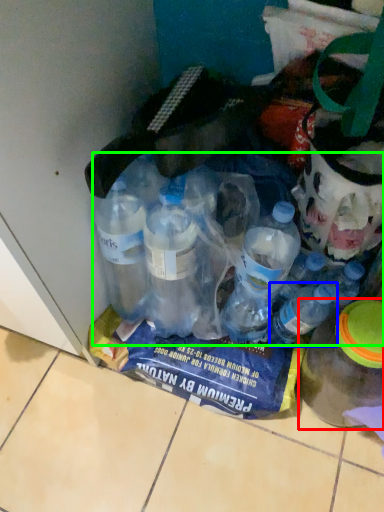
Question: Which object is the farthest from bottle (highlighted by a red box)? Choose among these: bottle (highlighted by a blue box) or bottle (highlighted by a green box).

Choices:
 (A) bottle
 (B) bottle

Answer: (B)